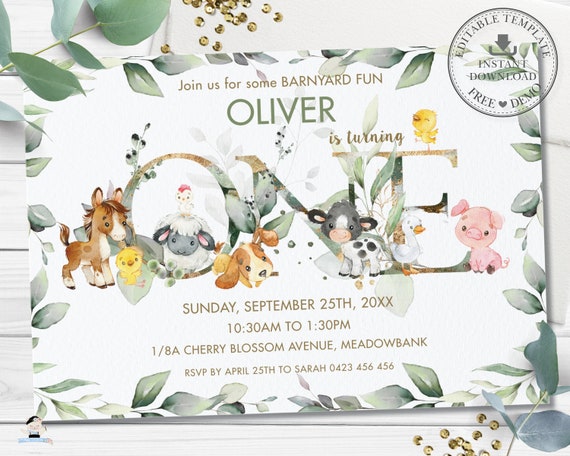
I want to click on table, so click(7, 287).